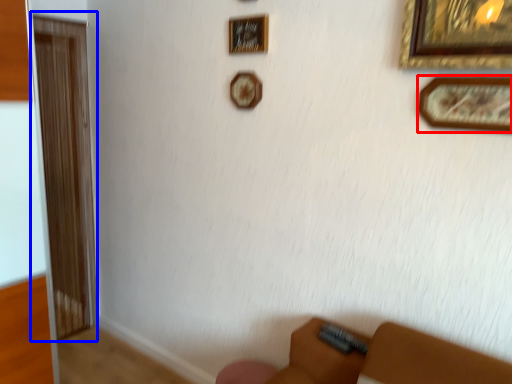
Question: Which point is further to the camera, picture frame (highlighted by a red box) or screen door (highlighted by a blue box)?

Choices:
 (A) picture frame
 (B) screen door

Answer: (B)